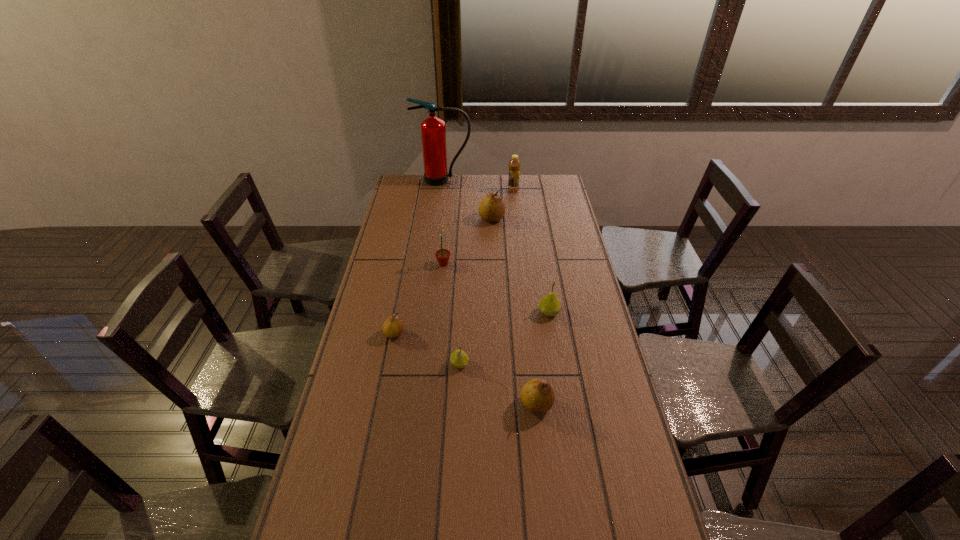
The width and height of the screenshot is (960, 540). Identify the location of blank space located 0.110m on the back of the rightmost brown pear. (532, 362).

This screenshot has height=540, width=960. Find the location of `vacant space located 0.210m on the front of the smallest brown pear`. vacant space located 0.210m on the front of the smallest brown pear is located at coordinates (383, 394).

Find the location of `vacant space situated 0.190m on the left of the second nearest object`. vacant space situated 0.190m on the left of the second nearest object is located at coordinates (392, 363).

The height and width of the screenshot is (540, 960). In order to click on fire extinguisher that is positioned at the far edge in this screenshot , I will do `click(433, 131)`.

The width and height of the screenshot is (960, 540). What are the coordinates of `bottle situated at the far edge` in the screenshot? It's located at (514, 165).

The image size is (960, 540). Find the location of `fire extinguisher located in the left edge section of the desktop`. fire extinguisher located in the left edge section of the desktop is located at coordinates (433, 131).

This screenshot has width=960, height=540. In order to click on pear that is at the left edge in this screenshot , I will do `click(393, 327)`.

At what (x,y) coordinates should I click in order to perform the action: click on object located in the right edge section of the desktop. Please return your answer as a coordinate pair (x, y). Looking at the image, I should click on (549, 305).

Locate an element on the screen. object situated at the far left corner is located at coordinates (433, 131).

Where is `free space at the far edge of the desktop`? free space at the far edge of the desktop is located at coordinates (463, 189).